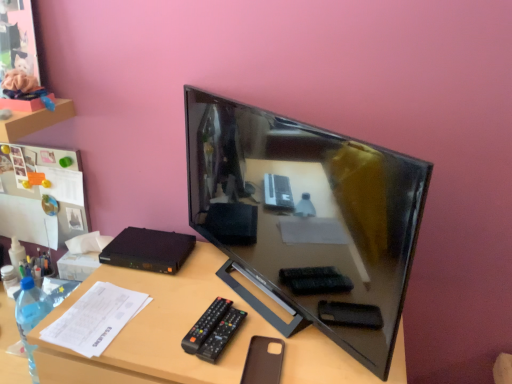
Find the location of a particular element. This screenshot has width=512, height=384. black plastic remote at lower center is located at coordinates (215, 331).

Describe the element at coordinates (184, 334) in the screenshot. The image size is (512, 384). I see `brown matte desk at center` at that location.

In order to face black glossy television at center, should I rotate leftwards or rightwards?

Rotate right and turn 2.581 degrees.

This screenshot has height=384, width=512. What do you see at coordinates (95, 319) in the screenshot?
I see `white paper at lower left` at bounding box center [95, 319].

Where is `brown leather phone case at lower center`? brown leather phone case at lower center is located at coordinates (263, 361).

The image size is (512, 384). Identify the location of black plastic remote at lower center. (215, 331).

Which of these two, black glossy television at center or brown matte desk at center, is wider?

Wider between the two is brown matte desk at center.

From the image's perspective, is black glossy television at center above brown matte desk at center?

Correct, black glossy television at center appears higher than brown matte desk at center in the image.

Between black glossy television at center and brown matte desk at center, which one has larger size?

With larger size is brown matte desk at center.

Where is `desk behind the black glossy television at center`? This screenshot has width=512, height=384. desk behind the black glossy television at center is located at coordinates (184, 334).

How different are the orientations of black plastic remote at lower center and white paper at lower left in degrees?

5.98 degrees.

Does black plastic remote at lower center come in front of white paper at lower left?

Yes.

From the image's perspective, is black plastic remote at lower center on white paper at lower left?

No, from the image's perspective, black plastic remote at lower center is not over white paper at lower left.

In terms of width, does black plastic remote at lower center look wider or thinner when compared to black glossy television at center?

In the image, black plastic remote at lower center appears to be wider than black glossy television at center.

From the image's perspective, is black plastic remote at lower center beneath black glossy television at center?

Yes, from the image's perspective, black plastic remote at lower center is below black glossy television at center.

What's the angular difference between black plastic remote at lower center and black glossy television at center's facing directions?

The angular difference between black plastic remote at lower center and black glossy television at center is 29.8 degrees.

From the picture: Which is farther, [228,327] or [262,188]?

Positioned behind is point [262,188].

Which of these two, black glossy television at center or black plastic remote at lower center, is thinner?

black glossy television at center.

From the image's perspective, is black glossy television at center on black plastic remote at lower center?

Yes, from the image's perspective, black glossy television at center is above black plastic remote at lower center.

Are black glossy television at center and black plastic remote at lower center making contact?

There is a gap between black glossy television at center and black plastic remote at lower center.

Is black plastic remote at lower center a part of black glossy television at center?

No.

From a real-world perspective, who is located higher, brown leather phone case at lower center or white paper at lower left?

From a 3D spatial view, white paper at lower left is above.

How distant is brown leather phone case at lower center from white paper at lower left?

The distance of brown leather phone case at lower center from white paper at lower left is 13.93 inches.

From the image's perspective, is brown leather phone case at lower center located beneath white paper at lower left?

Correct, brown leather phone case at lower center appears lower than white paper at lower left in the image.

Is brown leather phone case at lower center shorter than white paper at lower left?

Indeed, brown leather phone case at lower center has a lesser height compared to white paper at lower left.

Is white paper at lower left positioned with its back to brown matte desk at center?

Correct, white paper at lower left is looking away from brown matte desk at center.

Is white paper at lower left thinner than brown matte desk at center?

Correct, the width of white paper at lower left is less than that of brown matte desk at center.

Is white paper at lower left inside the boundaries of brown matte desk at center, or outside?

white paper at lower left exists entirely within brown matte desk at center.

Are white paper at lower left and brown matte desk at center located far from each other?

Actually, white paper at lower left and brown matte desk at center are a little close together.

Are white paper at lower left and black glossy television at center located far from each other?

Actually, white paper at lower left and black glossy television at center are a little close together.

Does point (106, 343) appear closer or farther from the camera than point (316, 132)?

Point (106, 343) is farther from the camera than point (316, 132).

Can you confirm if white paper at lower left is positioned to the right of black glossy television at center?

No.

Does white paper at lower left have a larger size compared to black glossy television at center?

No.

Identify the location of television in front of the brown matte desk at center. This screenshot has height=384, width=512. tap(309, 215).

The width and height of the screenshot is (512, 384). I want to click on paper beneath the black plastic remote at lower center (from a real-world perspective), so click(95, 319).

Considering their positions, is black plastic remote at lower center positioned further to white paper at lower left than black glossy television at center?

Based on the image, black glossy television at center appears to be further to white paper at lower left.

Based on their spatial positions, is white paper at lower left or black glossy television at center closer to black plastic remote at lower center?

The object closer to black plastic remote at lower center is white paper at lower left.

Looking at this image, from the image, which object appears to be nearer to black glossy television at center, white paper at lower left or black plastic remote at lower center?

black plastic remote at lower center.

Looking at the image, which one is located closer to brown leather phone case at lower center, black glossy television at center or brown matte desk at center?

brown matte desk at center is closer to brown leather phone case at lower center.

Based on their spatial positions, is brown matte desk at center or brown leather phone case at lower center further from black plastic remote at lower center?

The object further to black plastic remote at lower center is brown matte desk at center.

When comparing their distances from black glossy television at center, does brown leather phone case at lower center or brown matte desk at center seem closer?

Among the two, brown matte desk at center is located nearer to black glossy television at center.

When comparing their distances from brown matte desk at center, does brown leather phone case at lower center or black glossy television at center seem closer?

brown leather phone case at lower center.

Looking at this image, which object lies further to the anchor point brown leather phone case at lower center, black glossy television at center or black plastic remote at lower center?

black glossy television at center lies further to brown leather phone case at lower center than the other object.

The width and height of the screenshot is (512, 384). In order to click on remote between black glossy television at center and brown leather phone case at lower center vertically in this screenshot , I will do `click(215, 331)`.

Identify the location of desk between white paper at lower left and brown leather phone case at lower center. (184, 334).

Find the location of a particular element. This screenshot has height=384, width=512. remote situated between white paper at lower left and black glossy television at center from left to right is located at coordinates (215, 331).

At what (x,y) coordinates should I click in order to perform the action: click on paper that lies between black glossy television at center and brown matte desk at center from top to bottom. Please return your answer as a coordinate pair (x, y). The image size is (512, 384). Looking at the image, I should click on (95, 319).